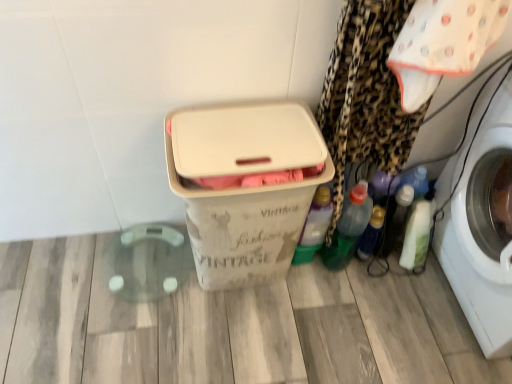
Locate an element on the screen. vacant space in front of white glossy bottle at lower right, marked as the fourth bottle in a left-to-right arrangement is located at coordinates (414, 299).